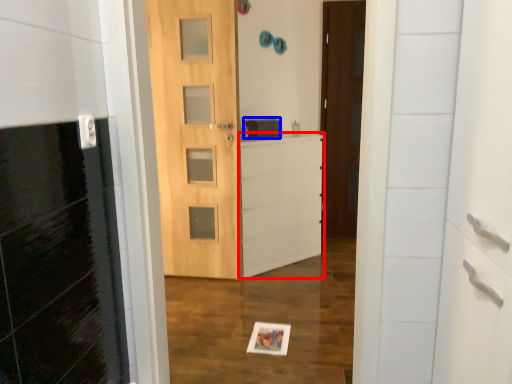
Question: Which point is closer to the camera, file cabinet (highlighted by a red box) or medicine cabinet (highlighted by a blue box)?

Choices:
 (A) file cabinet
 (B) medicine cabinet

Answer: (A)